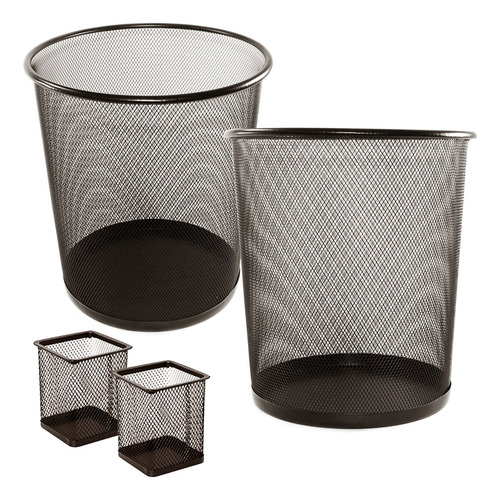
This screenshot has width=500, height=500. I want to click on rim of trashcan, so click(261, 85), click(285, 136), click(168, 386), click(112, 348).